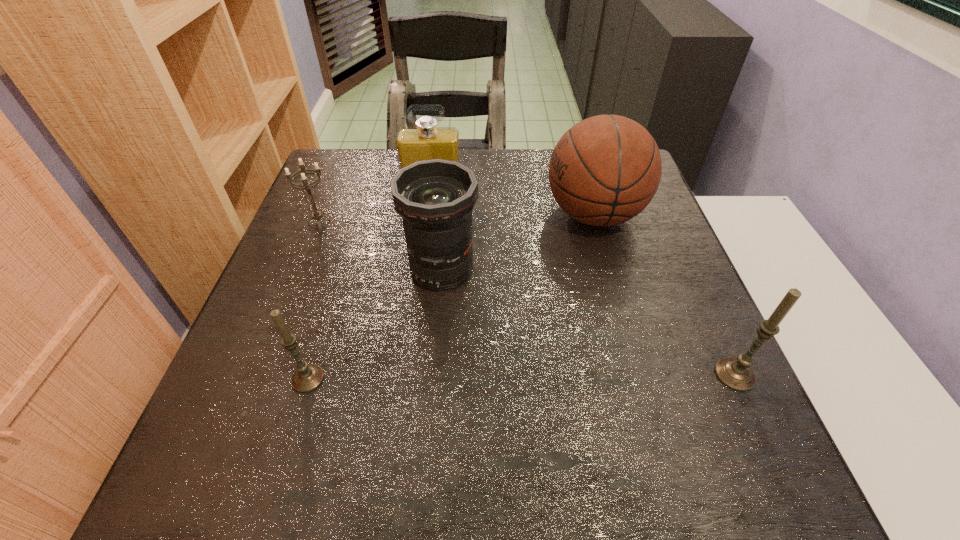
If equal spacing is desired by inserting an extra candle among them, please point out a free spot for this new candle. Please provide its 2D coordinates. Your answer should be formatted as a tuple, i.e. [(x, y)], where the tuple contains the x and y coordinates of a point satisfying the conditions above.

[(522, 376)]